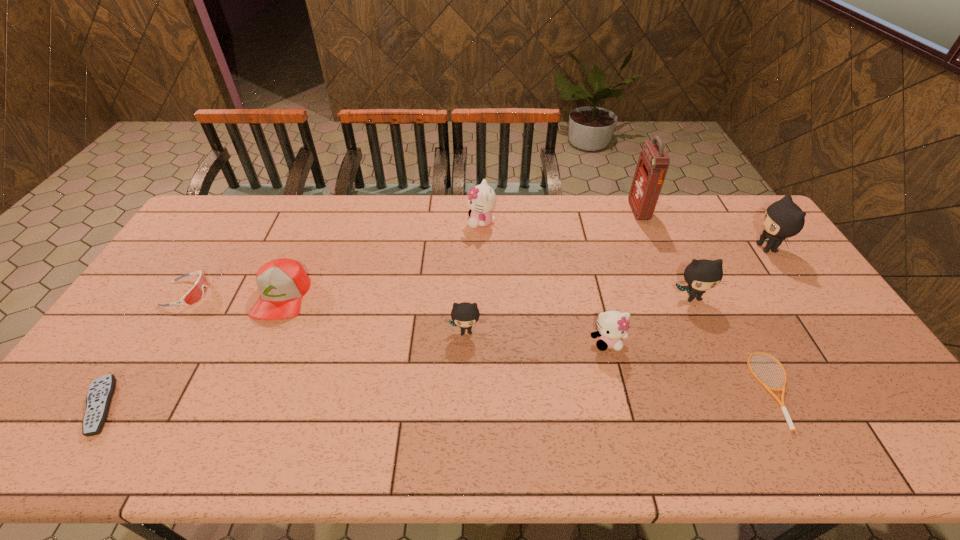
The height and width of the screenshot is (540, 960). Find the location of `object situated at the right edge`. object situated at the right edge is located at coordinates (783, 219).

At what (x,y) coordinates should I click in order to perform the action: click on object that is positioned at the near left corner. Please return your answer as a coordinate pair (x, y). Image resolution: width=960 pixels, height=540 pixels. Looking at the image, I should click on (101, 390).

I want to click on object that is positioned at the far right corner, so click(x=783, y=219).

In the image, there is a desktop. Where is `vacant space at the far edge`? vacant space at the far edge is located at coordinates (248, 222).

I want to click on blank space at the near edge, so click(x=268, y=439).

Where is `free space at the left edge`? Image resolution: width=960 pixels, height=540 pixels. free space at the left edge is located at coordinates (120, 394).

Identify the location of vacant point at the right edge. This screenshot has width=960, height=540. (745, 240).

Find the location of a particular element. vacant region at the far left corner of the desktop is located at coordinates (223, 208).

Where is `vacant space at the near right corner of the desktop`? vacant space at the near right corner of the desktop is located at coordinates (935, 459).

At what (x,y) coordinates should I click in order to perform the action: click on empty location between the leftmost gray kitten and the right white kitten. Please return your answer as a coordinate pair (x, y). Looking at the image, I should click on (537, 336).